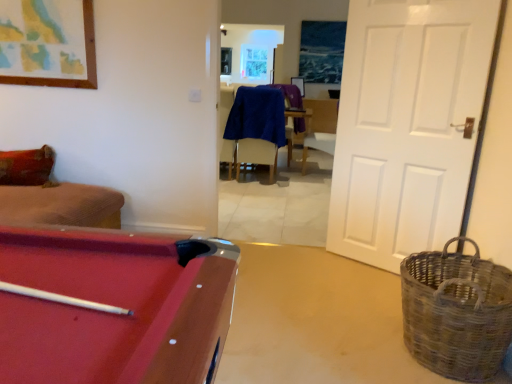
Question: From a real-world perspective, is blue fabric armchair at center beneath white matte door at right?

Choices:
 (A) yes
 (B) no

Answer: (A)

Question: Does blue fabric armchair at center have a smaller size compared to white matte door at right?

Choices:
 (A) no
 (B) yes

Answer: (A)

Question: From a real-world perspective, is blue fabric armchair at center physically above white matte door at right?

Choices:
 (A) no
 (B) yes

Answer: (A)

Question: Is blue fabric armchair at center turned away from white matte door at right?

Choices:
 (A) no
 (B) yes

Answer: (A)

Question: Is blue fabric armchair at center located outside white matte door at right?

Choices:
 (A) no
 (B) yes

Answer: (B)

Question: Does blue fabric armchair at center have a greater width compared to white matte door at right?

Choices:
 (A) yes
 (B) no

Answer: (A)

Question: Is blue fabric armchair at center next to rubberized red pool table at lower left?

Choices:
 (A) yes
 (B) no

Answer: (B)

Question: Does blue fabric armchair at center turn towards rubberized red pool table at lower left?

Choices:
 (A) no
 (B) yes

Answer: (B)

Question: Is blue fabric armchair at center to the left of rubberized red pool table at lower left from the viewer's perspective?

Choices:
 (A) yes
 (B) no

Answer: (B)

Question: Can you confirm if blue fabric armchair at center is smaller than rubberized red pool table at lower left?

Choices:
 (A) no
 (B) yes

Answer: (A)

Question: Considering the relative sizes of blue fabric armchair at center and rubberized red pool table at lower left in the image provided, is blue fabric armchair at center thinner than rubberized red pool table at lower left?

Choices:
 (A) yes
 (B) no

Answer: (A)

Question: Would you say rubberized red pool table at lower left is part of blue fabric armchair at center's contents?

Choices:
 (A) no
 (B) yes

Answer: (A)

Question: Can you confirm if blue fabric chair at center is bigger than blue fabric armchair at center?

Choices:
 (A) no
 (B) yes

Answer: (B)